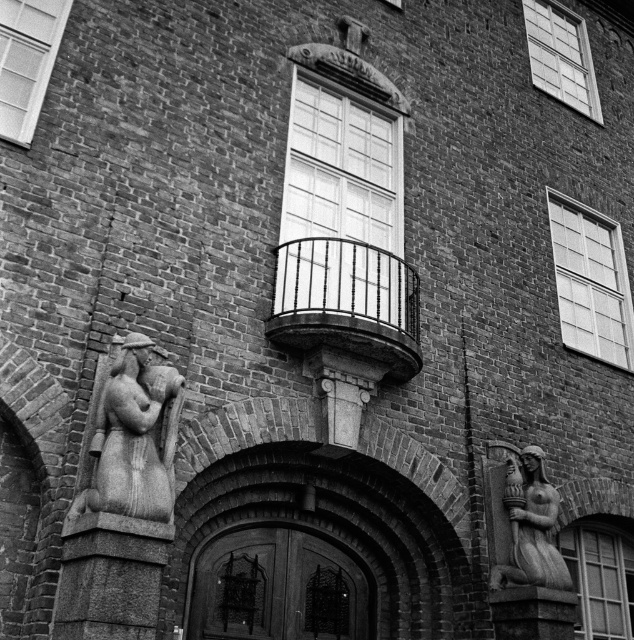
Is black wrought iron balcony at center below carved stone couple at left?

No, black wrought iron balcony at center is not below carved stone couple at left.

Is black wrought iron balcony at center thinner than carved stone couple at left?

No, black wrought iron balcony at center is not thinner than carved stone couple at left.

Describe the element at coordinates (347, 304) in the screenshot. This screenshot has height=640, width=634. I see `black wrought iron balcony at center` at that location.

Image resolution: width=634 pixels, height=640 pixels. I want to click on black wrought iron balcony at center, so click(x=347, y=304).

This screenshot has height=640, width=634. What do you see at coordinates (134, 436) in the screenshot?
I see `carved stone couple at left` at bounding box center [134, 436].

Does carved stone couple at left have a smaller size compared to gray stone statue at lower right?

Yes.

Is point (136, 404) less distant than point (545, 557)?

Yes, point (136, 404) is in front of point (545, 557).

Locate an element on the screen. The width and height of the screenshot is (634, 640). carved stone couple at left is located at coordinates (134, 436).

Does point (301, 260) come closer to viewer compared to point (550, 554)?

That is False.

Which is more to the right, black wrought iron balcony at center or gray stone statue at lower right?

From the viewer's perspective, gray stone statue at lower right appears more on the right side.

Is point (333, 292) behind point (531, 579)?

Yes, it is.

I want to click on black wrought iron balcony at center, so (347, 304).